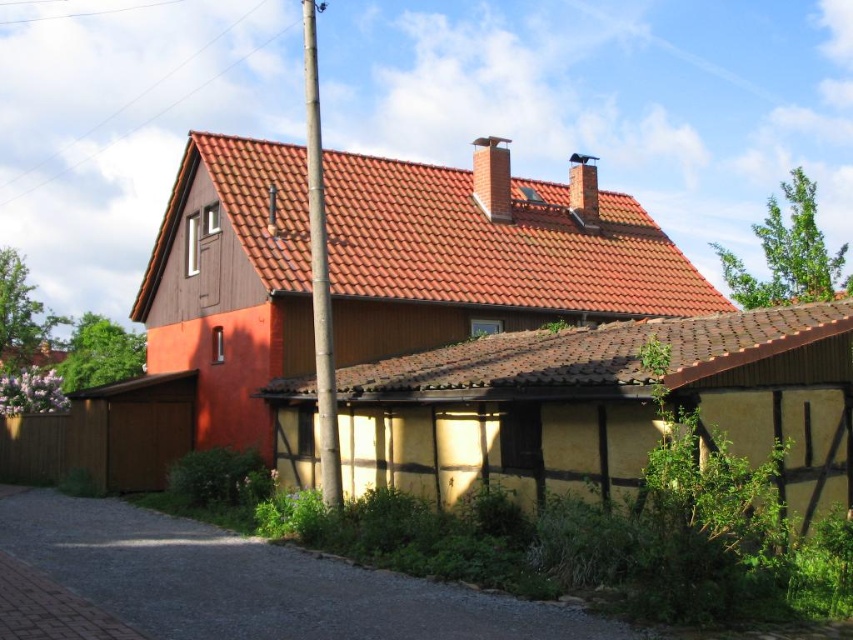
Question: Which object is farther from the camera taking this photo?

Choices:
 (A) smooth brick chimney at upper center
 (B) smooth gray chimney at upper center
 (C) smooth bamboo pole at center

Answer: (A)

Question: Which object is the closest to the smooth gray chimney at upper center?

Choices:
 (A) smooth brick chimney at upper center
 (B) smooth bamboo pole at center

Answer: (A)

Question: Does smooth gray chimney at upper center lie behind smooth brick chimney at upper center?

Choices:
 (A) yes
 (B) no

Answer: (B)

Question: Considering the relative positions of smooth bamboo pole at center and smooth brick chimney at upper center in the image provided, where is smooth bamboo pole at center located with respect to smooth brick chimney at upper center?

Choices:
 (A) above
 (B) below

Answer: (A)

Question: Estimate the real-world distances between objects in this image. Which object is farther from the smooth brick chimney at upper center?

Choices:
 (A) smooth gray chimney at upper center
 (B) smooth bamboo pole at center

Answer: (B)

Question: Is smooth gray chimney at upper center to the left of smooth brick chimney at upper center from the viewer's perspective?

Choices:
 (A) yes
 (B) no

Answer: (A)